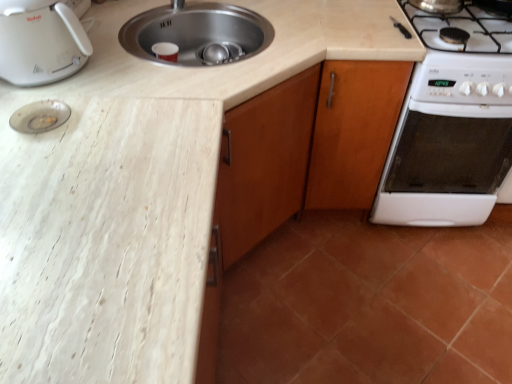
This screenshot has width=512, height=384. I want to click on vacant area to the right of white plastic toaster at upper left, so click(x=133, y=75).